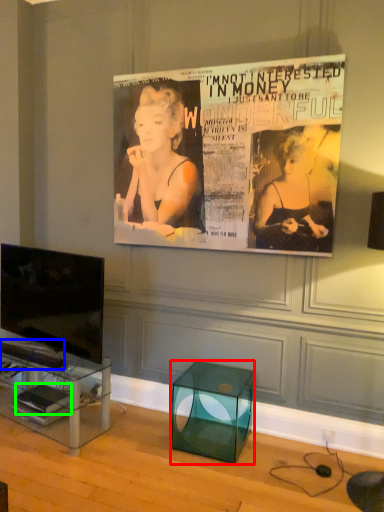
Question: Which object is positioned closest to glass box (highlighted by a red box)? Select from magazine (highlighted by a blue box) and magazine (highlighted by a green box).

Choices:
 (A) magazine
 (B) magazine

Answer: (B)